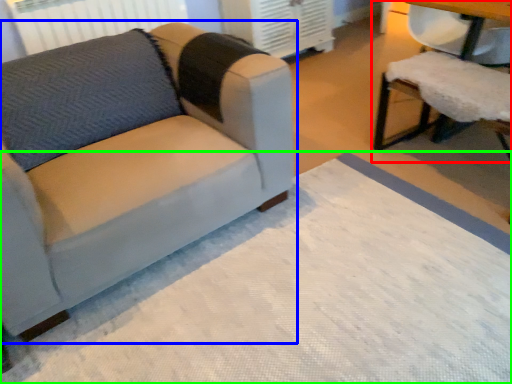
Question: Considering the real-world distances, which object is farthest from chair (highlighted by a red box)? studio couch (highlighted by a blue box) or mat (highlighted by a green box)?

Choices:
 (A) studio couch
 (B) mat

Answer: (A)